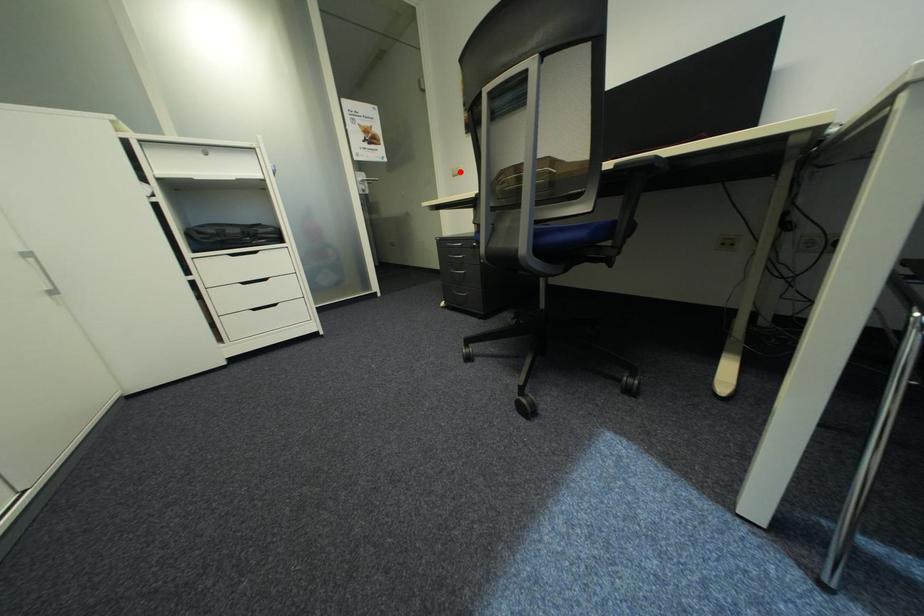
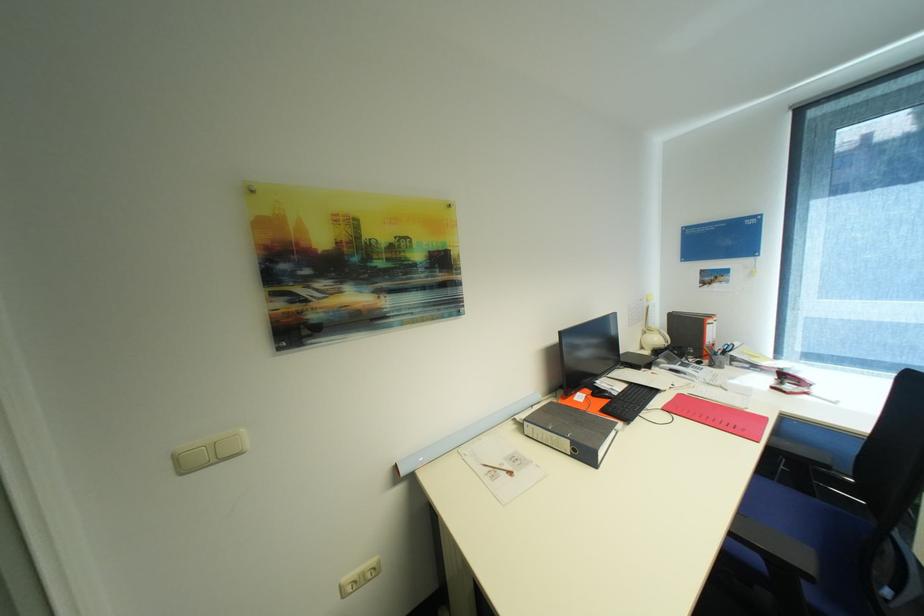
Question: I am providing you with two images of the same scene from different viewpoints. In image1, a red point is highlighted. Considering the same 3D point in image2, which of the following is correct?

Choices:
 (A) It is closer
 (B) It is farther

Answer: (B)